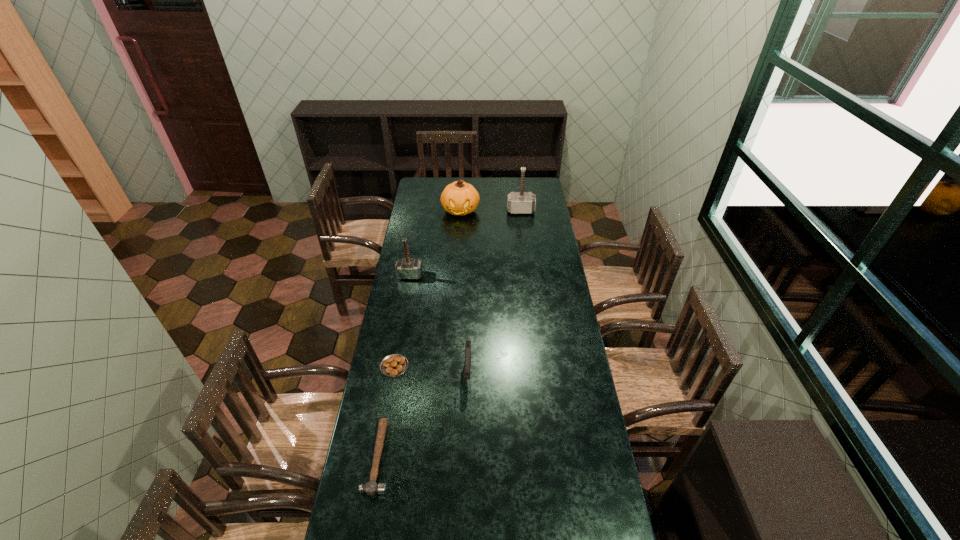
Identify the location of hammer that is the second closest to the pumpkin. (406, 268).

Image resolution: width=960 pixels, height=540 pixels. I want to click on hammer identified as the closest to the pumpkin, so click(x=521, y=202).